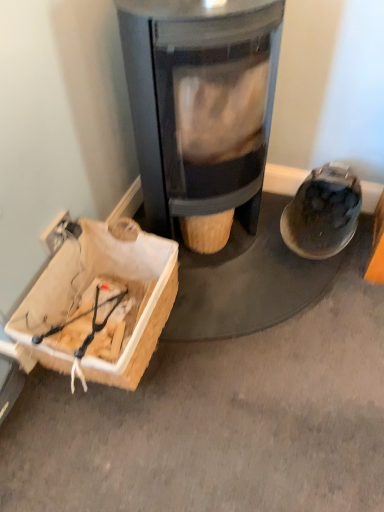
At what (x,y) coordinates should I click in order to perform the action: click on vacant area that lies between matte black wood burning stove at center and wooden crate at lower left. Please return your answer as a coordinate pair (x, y). Looking at the image, I should click on 201,323.